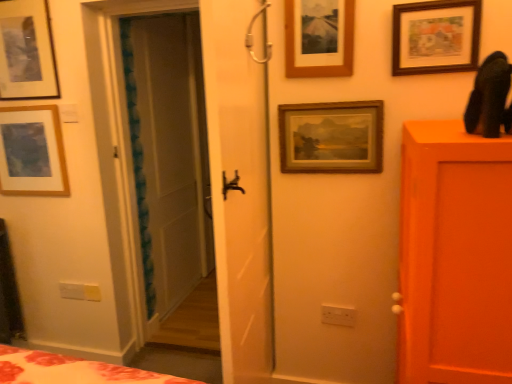
Question: Is wooden picture frame at upper right, which is counted as the 5th picture frame, starting from the left, to the right of wooden picture frame at upper center, which is the third picture frame in left-to-right order, from the viewer's perspective?

Choices:
 (A) yes
 (B) no

Answer: (A)

Question: Is the depth of wooden picture frame at upper right, which is counted as the 5th picture frame, starting from the left, less than that of wooden picture frame at upper center, which is the third picture frame in left-to-right order?

Choices:
 (A) no
 (B) yes

Answer: (B)

Question: Is wooden picture frame at upper right, which is counted as the 5th picture frame, starting from the left, behind wooden picture frame at upper center, which is counted as the third picture frame, starting from the right?

Choices:
 (A) no
 (B) yes

Answer: (A)

Question: Can you confirm if wooden picture frame at upper right, which is counted as the 1th picture frame, starting from the right, is taller than wooden picture frame at upper center, which is the third picture frame in left-to-right order?

Choices:
 (A) no
 (B) yes

Answer: (A)

Question: Is wooden picture frame at upper right, which is counted as the 1th picture frame, starting from the right, turned away from wooden picture frame at upper center, which is the third picture frame in left-to-right order?

Choices:
 (A) no
 (B) yes

Answer: (A)

Question: Considering the positions of wooden picture frame at upper right, which is counted as the 1th picture frame, starting from the right, and matte wooden picture frame at upper left, which ranks as the 5th picture frame in right-to-left order, in the image, is wooden picture frame at upper right, which is counted as the 1th picture frame, starting from the right, taller or shorter than matte wooden picture frame at upper left, which ranks as the 5th picture frame in right-to-left order,?

Choices:
 (A) short
 (B) tall

Answer: (A)

Question: Considering the positions of point (394, 6) and point (18, 163), is point (394, 6) closer or farther from the camera than point (18, 163)?

Choices:
 (A) farther
 (B) closer

Answer: (B)

Question: Considering the positions of wooden picture frame at upper right, which is counted as the 1th picture frame, starting from the right, and matte wooden picture frame at upper left, which ranks as the 5th picture frame in right-to-left order, in the image, is wooden picture frame at upper right, which is counted as the 1th picture frame, starting from the right, bigger or smaller than matte wooden picture frame at upper left, which ranks as the 5th picture frame in right-to-left order,?

Choices:
 (A) small
 (B) big

Answer: (A)

Question: In terms of width, does wooden picture frame at upper right, which is counted as the 1th picture frame, starting from the right, look wider or thinner when compared to matte wooden picture frame at upper left, which ranks as the 5th picture frame in right-to-left order?

Choices:
 (A) thin
 (B) wide

Answer: (A)

Question: From the image's perspective, relative to wooden picture frame at upper center, which is the third picture frame in left-to-right order, is white plastic electric outlet at lower center above or below?

Choices:
 (A) below
 (B) above

Answer: (A)

Question: Do you think white plastic electric outlet at lower center is within wooden picture frame at upper center, which is the third picture frame in left-to-right order, or outside of it?

Choices:
 (A) outside
 (B) inside

Answer: (A)

Question: Is point (353, 317) closer or farther from the camera than point (287, 0)?

Choices:
 (A) farther
 (B) closer

Answer: (A)

Question: Considering the positions of white plastic electric outlet at lower center and wooden picture frame at upper center, which is counted as the third picture frame, starting from the right, in the image, is white plastic electric outlet at lower center taller or shorter than wooden picture frame at upper center, which is counted as the third picture frame, starting from the right,?

Choices:
 (A) tall
 (B) short

Answer: (B)

Question: Based on their sizes in the image, would you say wooden picture frame at upper center, which is the third picture frame in left-to-right order, is bigger or smaller than wooden framed painting at center, marked as the fourth picture frame in a left-to-right arrangement?

Choices:
 (A) small
 (B) big

Answer: (A)

Question: From a real-world perspective, is wooden picture frame at upper center, which is the third picture frame in left-to-right order, positioned above or below wooden framed painting at center, which is counted as the second picture frame, starting from the right?

Choices:
 (A) below
 (B) above

Answer: (B)